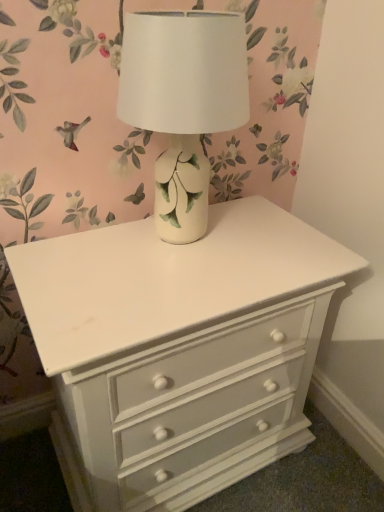
Find the location of a particular element. The width and height of the screenshot is (384, 512). vacant space underneath white ceramic table lamp at center (from a real-world perspective) is located at coordinates tap(189, 241).